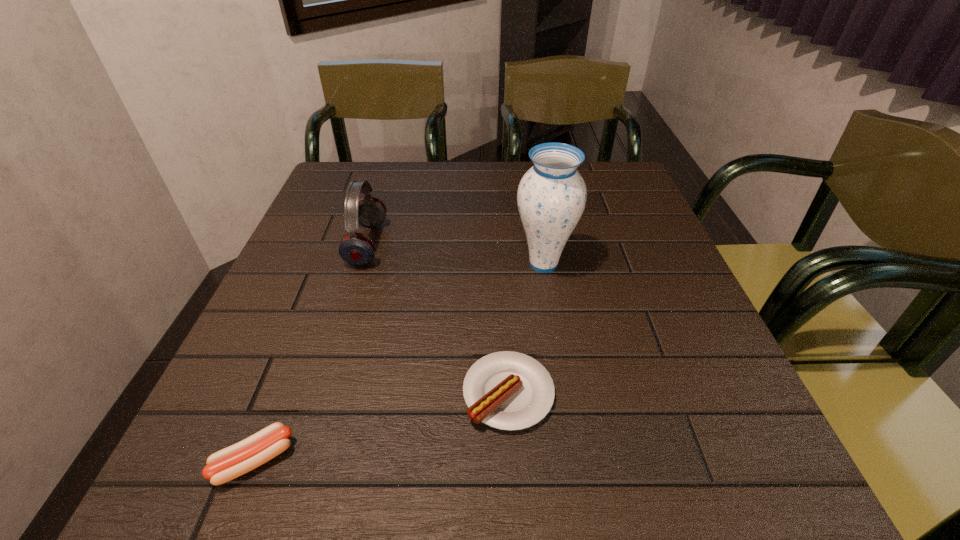
Locate an element on the screen. free space between the left sausage and the right sausage is located at coordinates click(x=381, y=427).

You are a GUI agent. You are given a task and a screenshot of the screen. Output one action in this format:
    pyautogui.click(x=<x>, y=<y>)
    Task: Click on the vacant area between the left sausage and the right sausage
    
    Given the screenshot: What is the action you would take?
    pyautogui.click(x=381, y=427)

Identify the location of free area in between the right sausage and the tallest object. Image resolution: width=960 pixels, height=540 pixels. (526, 328).

This screenshot has width=960, height=540. In order to click on vacant area that lies between the left sausage and the vase in this screenshot , I will do `click(399, 362)`.

Find the location of a particular element. The image size is (960, 540). free space between the earphone and the right sausage is located at coordinates (438, 319).

Find the location of a particular element. vacant space that is in between the left sausage and the right sausage is located at coordinates (381, 427).

Locate an element on the screen. Image resolution: width=960 pixels, height=540 pixels. free space between the right sausage and the earphone is located at coordinates (438, 319).

You are a GUI agent. You are given a task and a screenshot of the screen. Output one action in this format:
    pyautogui.click(x=<x>, y=<y>)
    Task: Click on the empty space that is in between the earphone and the vase
    The height and width of the screenshot is (540, 960).
    Given the screenshot: What is the action you would take?
    pyautogui.click(x=455, y=254)

Where is `free space between the vase and the left sausage`? Image resolution: width=960 pixels, height=540 pixels. free space between the vase and the left sausage is located at coordinates (399, 362).

You are a GUI agent. You are given a task and a screenshot of the screen. Output one action in this format:
    pyautogui.click(x=<x>, y=<y>)
    Task: Click on the object that can be found as the third closest to the third shortest object
    
    Given the screenshot: What is the action you would take?
    pyautogui.click(x=229, y=463)